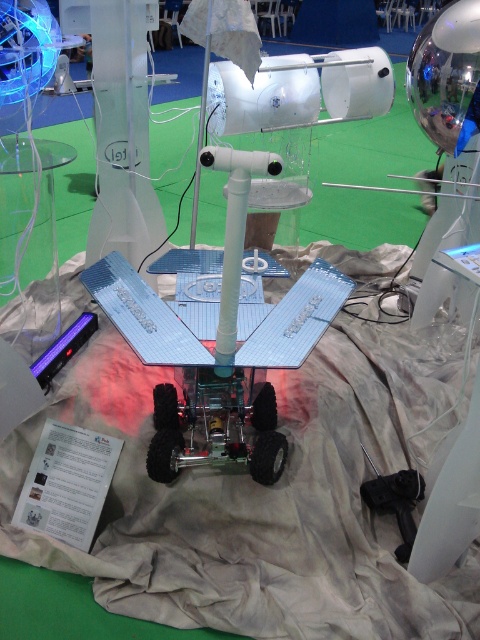
From the picture: How far apart are white fabric at center and transparent glass table at left?

white fabric at center and transparent glass table at left are 27.27 inches apart from each other.

Does white fabric at center appear on the right side of transparent glass table at left?

Yes, white fabric at center is to the right of transparent glass table at left.

Does point (249, 584) lie behind point (15, 232)?

That is False.

Locate an element on the screen. The height and width of the screenshot is (640, 480). white fabric at center is located at coordinates (257, 500).